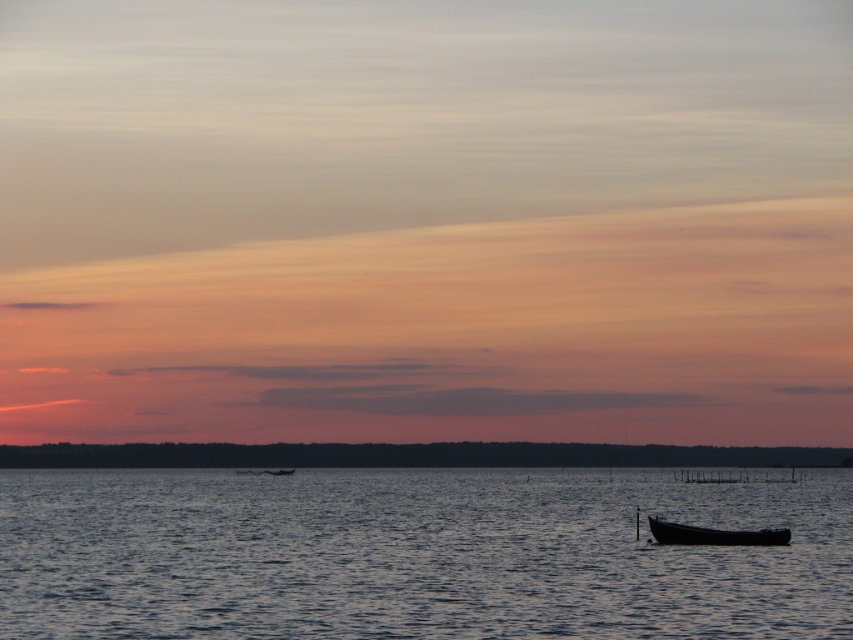
Where is `dark blue water at lower center`? dark blue water at lower center is located at coordinates (415, 554).

Looking at this image, between dark blue water at lower center and smooth black boat at center, which one has less height?

Standing shorter between the two is smooth black boat at center.

Describe the element at coordinates (415, 554) in the screenshot. The height and width of the screenshot is (640, 853). I see `dark blue water at lower center` at that location.

Where is `dark blue water at lower center`? The height and width of the screenshot is (640, 853). dark blue water at lower center is located at coordinates [x=415, y=554].

Who is higher up, dark blue water at lower center or dark matte horizon at center?

Positioned higher is dark blue water at lower center.

Between dark blue water at lower center and dark matte horizon at center, which one has more height?

Standing taller between the two is dark blue water at lower center.

The width and height of the screenshot is (853, 640). I want to click on dark blue water at lower center, so click(x=415, y=554).

Between point (653, 531) and point (285, 474), which one is positioned behind?

The point (285, 474) is more distant.

Is black matte canoe at lower right taller than smooth black boat at center?

In fact, black matte canoe at lower right may be shorter than smooth black boat at center.

Where is `black matte canoe at lower right`? The height and width of the screenshot is (640, 853). black matte canoe at lower right is located at coordinates coord(712,534).